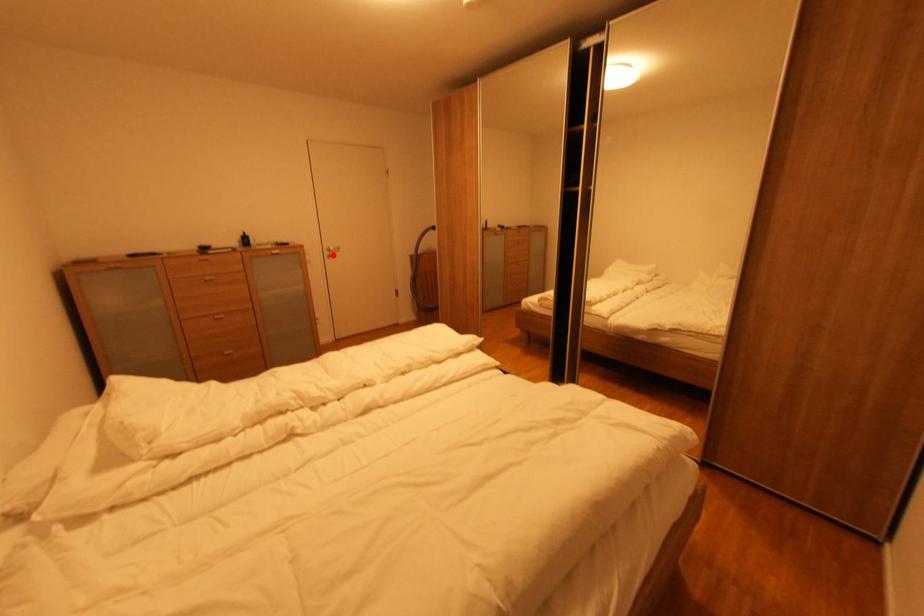
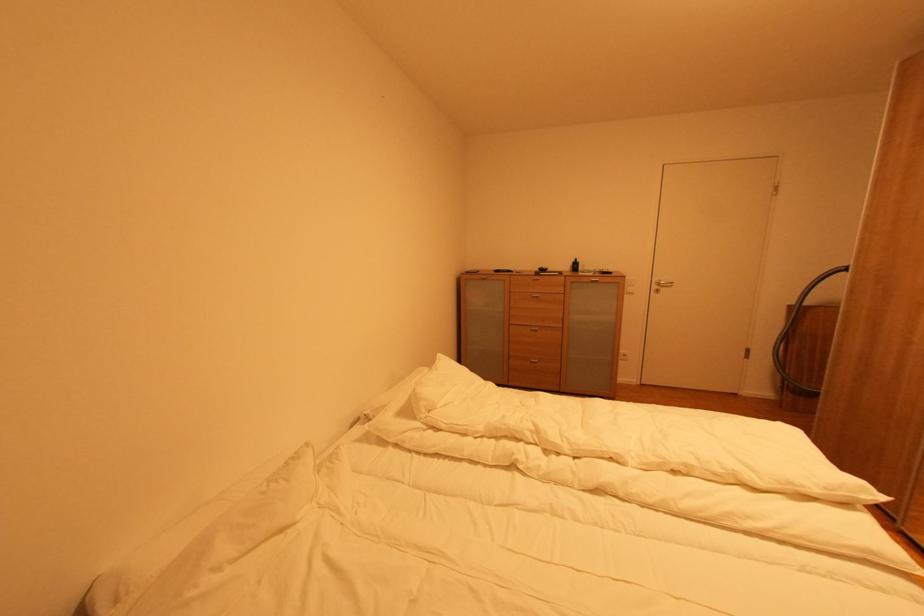
Locate, in the second image, the point that corresponds to the highlighted location in the first image.

(661, 289)